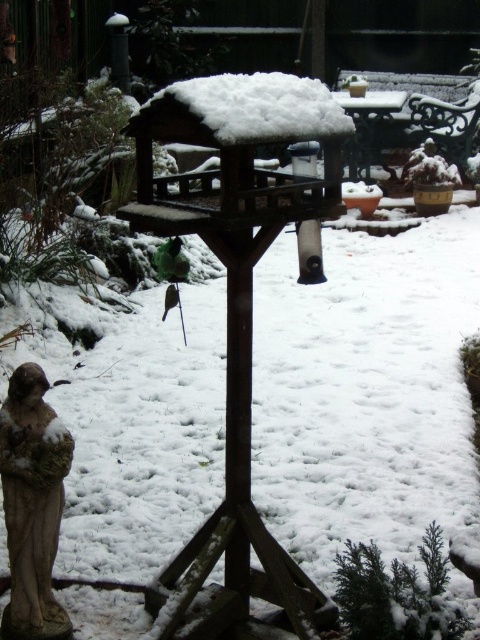
Who is shorter, stone statue at lower left or green matte bird at center-left?

Answer: Standing shorter between the two is green matte bird at center-left.

Who is positioned more to the right, stone statue at lower left or green matte bird at center-left?

Positioned to the right is green matte bird at center-left.

Locate an element on the screen. The image size is (480, 640). stone statue at lower left is located at coordinates (33, 504).

Is point (260, 122) positioned in front of point (169, 296)?

Yes, point (260, 122) is closer to viewer.

Between white fluffy snow at center and green matte bird at center-left, which one appears on the right side from the viewer's perspective?

white fluffy snow at center

What do you see at coordinates (261, 106) in the screenshot? The width and height of the screenshot is (480, 640). I see `white fluffy snow at center` at bounding box center [261, 106].

Locate an element on the screen. The image size is (480, 640). white fluffy snow at center is located at coordinates (261, 106).

Is stone statue at lower left to the left of white fluffy snow at center from the viewer's perspective?

Indeed, stone statue at lower left is positioned on the left side of white fluffy snow at center.

Who is positioned more to the right, stone statue at lower left or white fluffy snow at center?

white fluffy snow at center is more to the right.

This screenshot has width=480, height=640. What are the coordinates of `stone statue at lower left` in the screenshot? It's located at (33, 504).